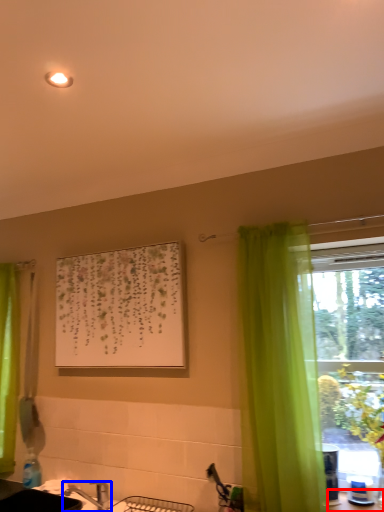
Question: Among these objects, which one is nearest to the camera, counter top (highlighted by a red box) or tap (highlighted by a blue box)?

Choices:
 (A) counter top
 (B) tap

Answer: (A)